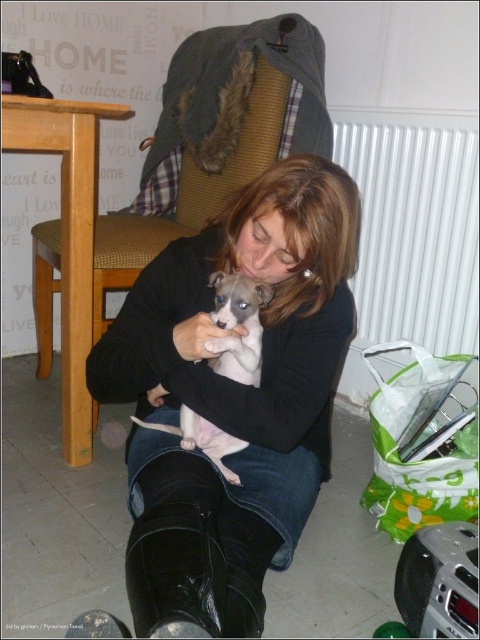
Question: In this image, where is black leather boots at lower center located relative to white fur puppy at center?

Choices:
 (A) above
 (B) below

Answer: (B)

Question: Is black leather boots at lower center closer to the viewer compared to white fur puppy at center?

Choices:
 (A) yes
 (B) no

Answer: (A)

Question: Does black leather boots at lower center have a smaller size compared to white fur puppy at center?

Choices:
 (A) yes
 (B) no

Answer: (B)

Question: Which point is farther to the camera?

Choices:
 (A) (252, 554)
 (B) (254, 330)

Answer: (B)

Question: Which of the following is the closest to the observer?

Choices:
 (A) (180, 280)
 (B) (202, 440)

Answer: (B)